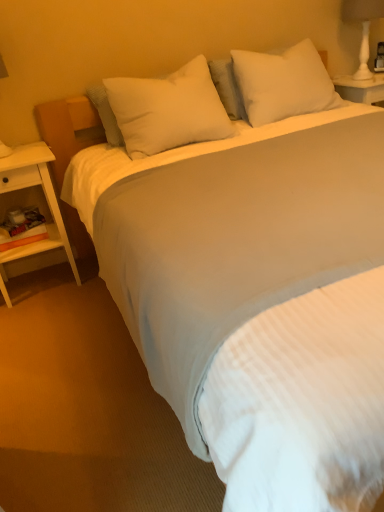
Question: From a real-world perspective, is white soft pillow at upper center, which ranks as the 2th pillow in left-to-right order, physically located above or below white ceramic lamp at upper right?

Choices:
 (A) above
 (B) below

Answer: (B)

Question: Which is correct: white soft pillow at upper center, acting as the first pillow starting from the right, is inside white ceramic lamp at upper right, or outside of it?

Choices:
 (A) inside
 (B) outside

Answer: (B)

Question: Which object is positioned farthest from the white wood nightstand at left?

Choices:
 (A) white soft pillow at upper center, the second pillow in the right-to-left sequence
 (B) white ceramic lamp at upper right
 (C) white soft pillow at upper center, acting as the first pillow starting from the right

Answer: (B)

Question: Which is nearer to the white ceramic lamp at upper right?

Choices:
 (A) white soft pillow at upper center, acting as the first pillow starting from the right
 (B) white soft pillow at upper center, the second pillow in the right-to-left sequence
 (C) white wood nightstand at left

Answer: (A)